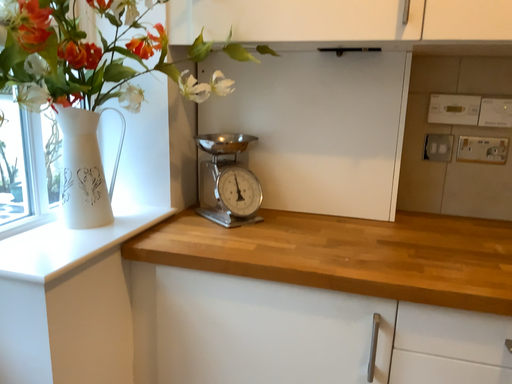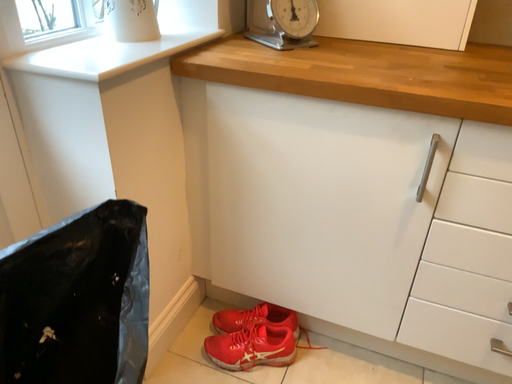
Question: Which way did the camera rotate in the video?

Choices:
 (A) rotated downward
 (B) rotated upward

Answer: (A)